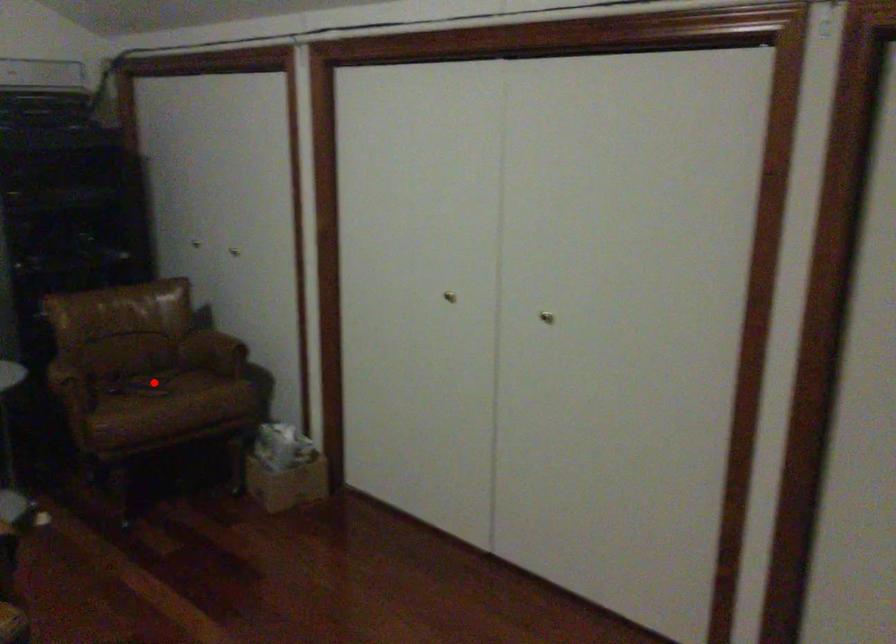
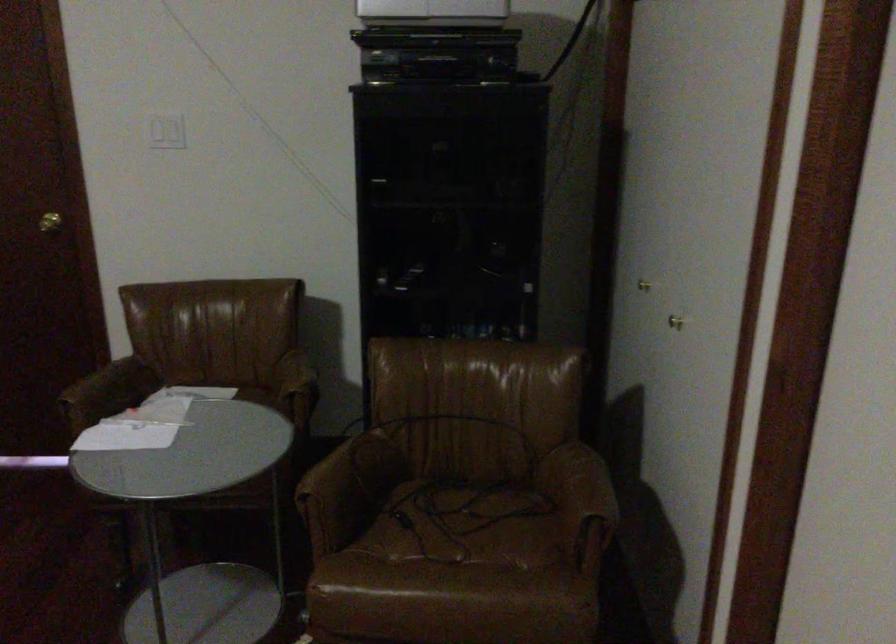
Find the pixel in the second image that matches the highlighted location in the first image.

(464, 525)